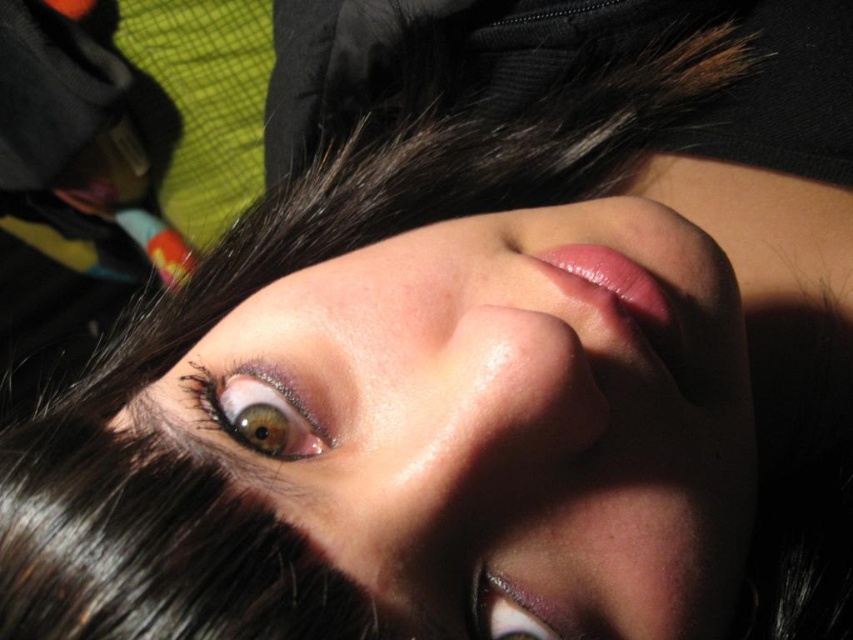
Based on the scene description, where is the shiny brown eye at center in relation to the smooth skin face at center?

The shiny brown eye at center is located below the smooth skin face at center.

You are a photographer adjusting the focus of your camera. You want to ensure both the shiny brown eye at upper left and the shiny brown eye at center are in focus. Which eye should you focus on first to achieve this?

You should focus on the shiny brown eye at upper left first because it is closer to the viewer than the shiny brown eye at center. By focusing on the closer object, the farther one may also come into focus depending on the depth of field.